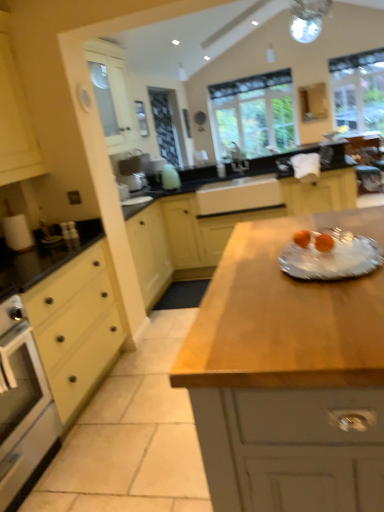
Question: Considering the positions of yellow matte drawer at left and white ceramic sink at center, the 1th sink positioned from the bottom, in the image, is yellow matte drawer at left wider or thinner than white ceramic sink at center, the 1th sink positioned from the bottom,?

Choices:
 (A) thin
 (B) wide

Answer: (B)

Question: From the image's perspective, is yellow matte drawer at left above or below white ceramic sink at center, arranged as the second sink when viewed from the top?

Choices:
 (A) below
 (B) above

Answer: (A)

Question: Based on their relative distances, which object is farther from the clear glass plate at center?

Choices:
 (A) wooden at center, the second countertop when ordered from back to front
 (B) matte yellow cabinet at left
 (C) clear glass window at center, which is the second window from right to left
 (D) white ceramic sink at center, the 1th sink positioned from the bottom
 (E) clear glass window at upper right, positioned as the 2th window in left-to-right order

Answer: (C)

Question: Estimate the real-world distances between objects in this image. Which object is closer to the wooden at center, which ranks as the 1th countertop in front-to-back order?

Choices:
 (A) black matte countertop at center, arranged as the 2th countertop when viewed from the front
 (B) clear glass window at center, which is the second window from right to left
 (C) yellow matte drawer at left
 (D) white ceramic sink at center, placed as the 1th sink when sorted from top to bottom
 (E) matte yellow cabinet at left

Answer: (C)